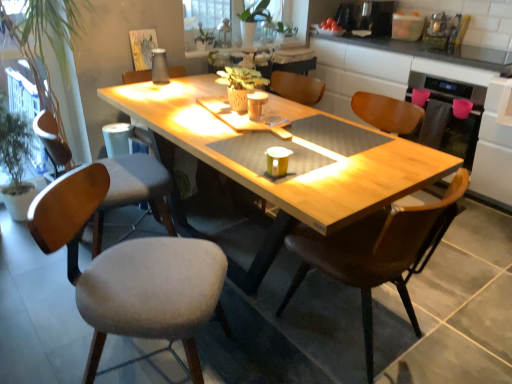
Question: Is light gray fabric chair at left, the second chair viewed from the right, bigger than white sheer curtain at upper center?

Choices:
 (A) no
 (B) yes

Answer: (B)

Question: Can we say light gray fabric chair at left, the second chair viewed from the right, lies outside white sheer curtain at upper center?

Choices:
 (A) no
 (B) yes

Answer: (B)

Question: Considering the relative positions of light gray fabric chair at left, the second chair from the left, and white sheer curtain at upper center in the image provided, is light gray fabric chair at left, the second chair from the left, to the right of white sheer curtain at upper center from the viewer's perspective?

Choices:
 (A) no
 (B) yes

Answer: (A)

Question: Does light gray fabric chair at left, the second chair viewed from the right, have a lesser height compared to white sheer curtain at upper center?

Choices:
 (A) yes
 (B) no

Answer: (B)

Question: Considering the relative sizes of light gray fabric chair at left, the second chair from the left, and white sheer curtain at upper center in the image provided, is light gray fabric chair at left, the second chair from the left, smaller than white sheer curtain at upper center?

Choices:
 (A) yes
 (B) no

Answer: (B)

Question: Is point (461, 173) positioned closer to the camera than point (165, 311)?

Choices:
 (A) closer
 (B) farther

Answer: (B)

Question: Is brown leather chair at center, placed as the third chair when sorted from left to right, inside or outside of light gray fabric chair at left, the second chair from the left?

Choices:
 (A) outside
 (B) inside

Answer: (A)

Question: Considering the positions of brown leather chair at center, placed as the first chair when sorted from right to left, and light gray fabric chair at left, the second chair from the left, in the image, is brown leather chair at center, placed as the first chair when sorted from right to left, taller or shorter than light gray fabric chair at left, the second chair from the left,?

Choices:
 (A) tall
 (B) short

Answer: (A)

Question: Considering the positions of brown leather chair at center, placed as the first chair when sorted from right to left, and light gray fabric chair at left, the second chair viewed from the right, in the image, is brown leather chair at center, placed as the first chair when sorted from right to left, bigger or smaller than light gray fabric chair at left, the second chair viewed from the right,?

Choices:
 (A) small
 (B) big

Answer: (B)

Question: Is gray fabric chair at left, positioned as the first chair in left-to-right order, inside or outside of green matte plant at upper center, placed as the first houseplant when sorted from right to left?

Choices:
 (A) outside
 (B) inside

Answer: (A)

Question: In the image, is gray fabric chair at left, the 3th chair when ordered from right to left, positioned in front of or behind green matte plant at upper center, arranged as the 1th houseplant when viewed from the back?

Choices:
 (A) behind
 (B) front

Answer: (B)

Question: From a real-world perspective, is gray fabric chair at left, positioned as the first chair in left-to-right order, positioned above or below green matte plant at upper center, arranged as the 1th houseplant when viewed from the back?

Choices:
 (A) above
 (B) below

Answer: (B)

Question: Is gray fabric chair at left, positioned as the first chair in left-to-right order, to the left or to the right of green matte plant at upper center, placed as the first houseplant when sorted from right to left, in the image?

Choices:
 (A) right
 (B) left

Answer: (B)

Question: Visually, is light gray fabric chair at left, the second chair from the left, positioned to the left or to the right of yellow matte coffee cup at center, which is the 1th coffee cup from front to back?

Choices:
 (A) left
 (B) right

Answer: (A)

Question: Does point (90, 365) appear closer or farther from the camera than point (271, 155)?

Choices:
 (A) closer
 (B) farther

Answer: (A)